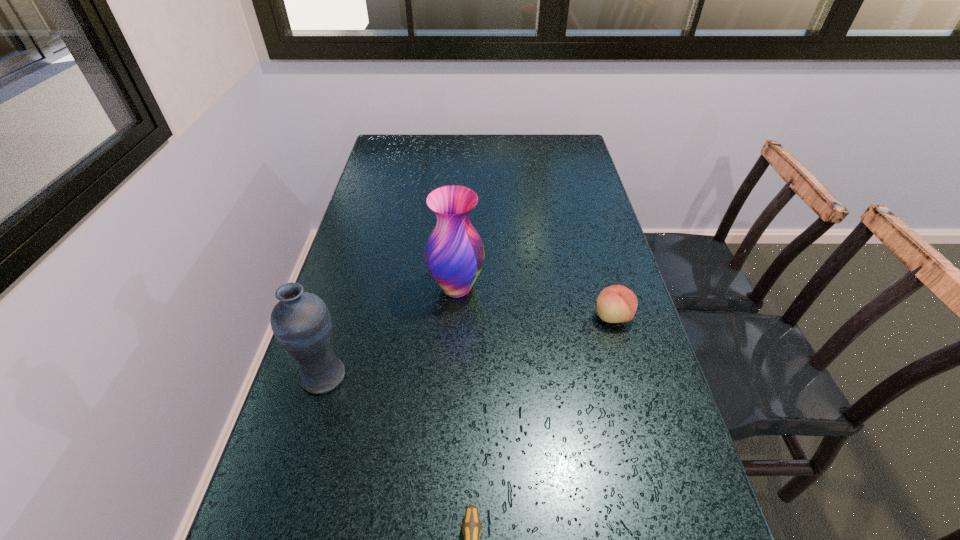
Locate an element on the screen. The height and width of the screenshot is (540, 960). the farther vase is located at coordinates (454, 253).

In order to click on the nearer vase in this screenshot , I will do `click(301, 322)`.

Identify the location of the third farthest object. (301, 322).

I want to click on peach, so click(615, 304).

Where is `the second shortest object`? the second shortest object is located at coordinates (615, 304).

Image resolution: width=960 pixels, height=540 pixels. I want to click on vacant position located on the right of the farther vase, so click(x=523, y=288).

Locate an element on the screen. Image resolution: width=960 pixels, height=540 pixels. vacant space located 0.380m on the right of the left vase is located at coordinates (522, 376).

You are a GUI agent. You are given a task and a screenshot of the screen. Output one action in this format:
    pyautogui.click(x=<x>, y=<y>)
    Task: Click on the free point located on the back of the second shortest object
    This screenshot has width=960, height=540.
    Given the screenshot: What is the action you would take?
    pyautogui.click(x=598, y=265)

You are a GUI agent. You are given a task and a screenshot of the screen. Output one action in this format:
    pyautogui.click(x=<x>, y=<y>)
    Task: Click on the object that is positioned at the left edge
    Image resolution: width=960 pixels, height=540 pixels.
    Given the screenshot: What is the action you would take?
    pyautogui.click(x=301, y=322)

What are the coordinates of `object that is positioned at the right edge` in the screenshot? It's located at (615, 304).